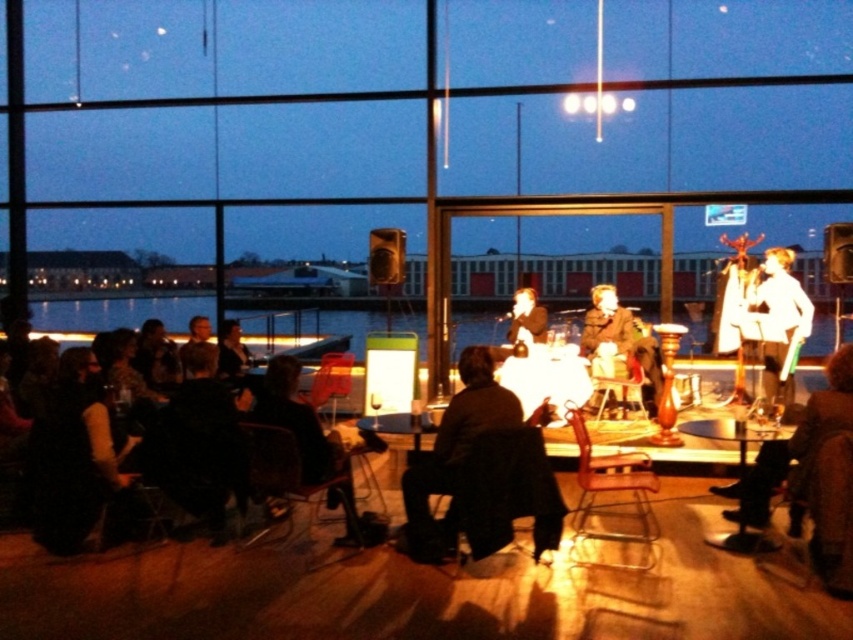
You are standing at the entrance of the venue and want to place a new decorative item on the table where the dark brown leather jacket at center is located. What are the exact coordinates where you should place the item?

The exact coordinates for placing the item should be at point (453, 454), which is where the dark brown leather jacket at center is located.

Consider the image. You are organizing a photoshoot and need to decide which suit to use based on their sizes. Given that the matte brown suit at center and the smooth black suit at center are both placed on the same table, which one would you choose if you want a wider lapel?

The matte brown suit at center has a larger width than the smooth black suit at center, so it would be the better choice for a wider lapel.

You are a stagehand who needs to place a 24 inch wide decorative panel between the matte brown suit at center and the smooth black suit at center. Can you fit it there?

The distance between the matte brown suit at center and the smooth black suit at center is 24.78 inches, so the 24 inch wide decorative panel can fit between them with some space to spare.